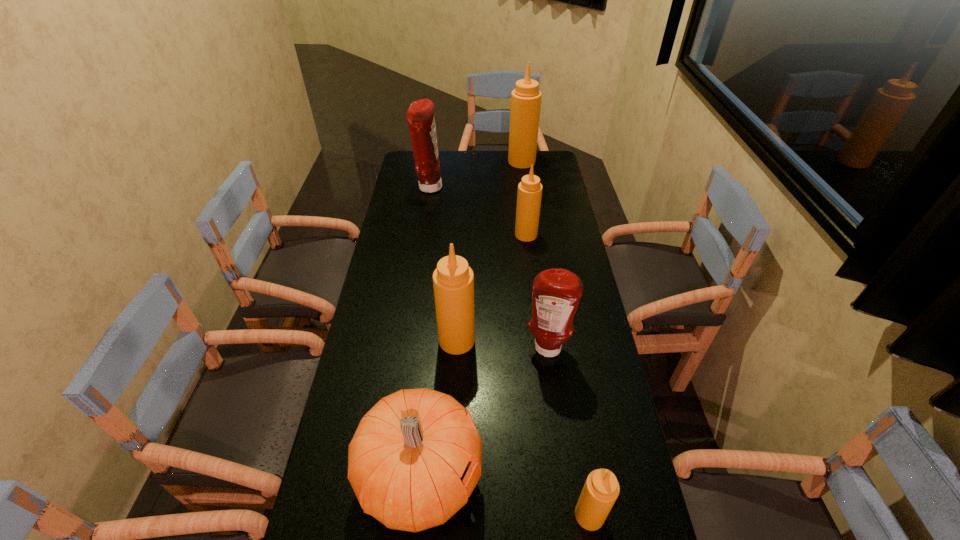
This screenshot has height=540, width=960. I want to click on the tallest object, so click(526, 97).

Find the location of a particular element. This screenshot has height=540, width=960. the tallest condiment is located at coordinates (526, 97).

I want to click on the sixth nearest object, so click(420, 117).

Where is `the farther red condiment`? the farther red condiment is located at coordinates (420, 117).

This screenshot has height=540, width=960. Find the location of `the third farthest tan condiment`. the third farthest tan condiment is located at coordinates (453, 280).

Where is `the second biggest tan condiment`? This screenshot has height=540, width=960. the second biggest tan condiment is located at coordinates (453, 280).

Identify the location of the second farthest tan condiment. Image resolution: width=960 pixels, height=540 pixels. (529, 195).

Identify the location of the fourth nearest condiment. (529, 195).

Identify the location of the nearer red condiment. This screenshot has width=960, height=540. (556, 293).

Where is `the right red condiment`? This screenshot has width=960, height=540. the right red condiment is located at coordinates (556, 293).